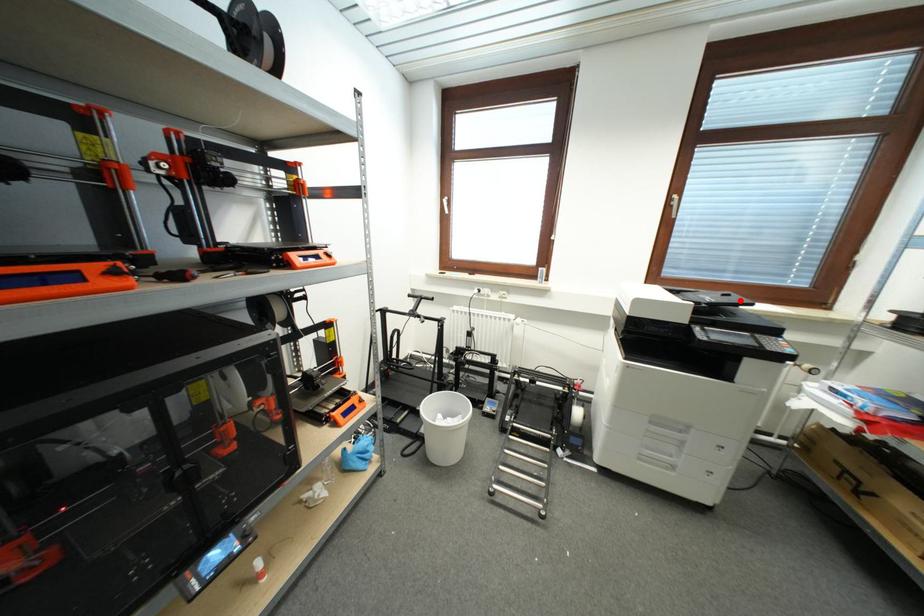
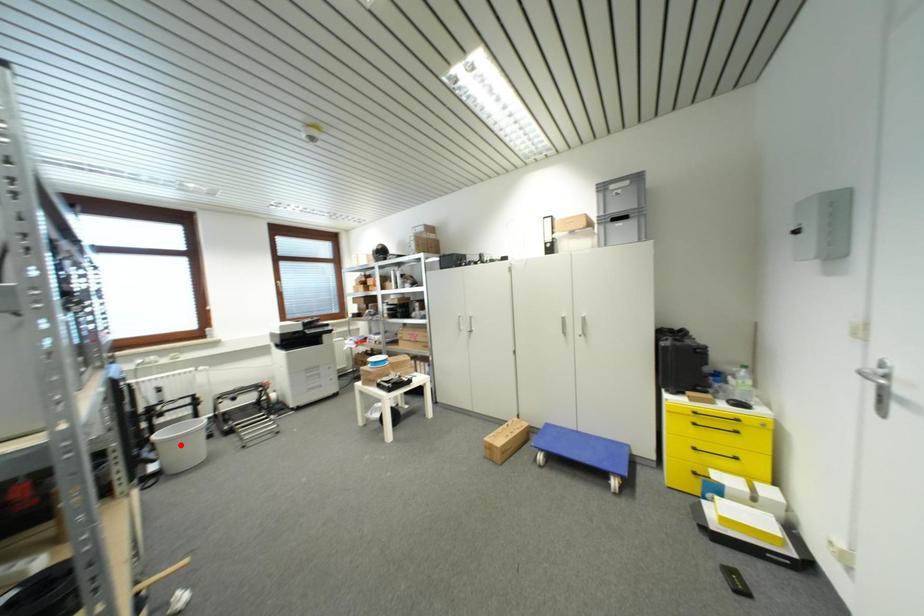
I am providing you with two images of the same scene from different viewpoints. A red point is marked on the first image and another point is marked on the second image. Are the points marked in image1 and image2 representing the same 3D position?

No